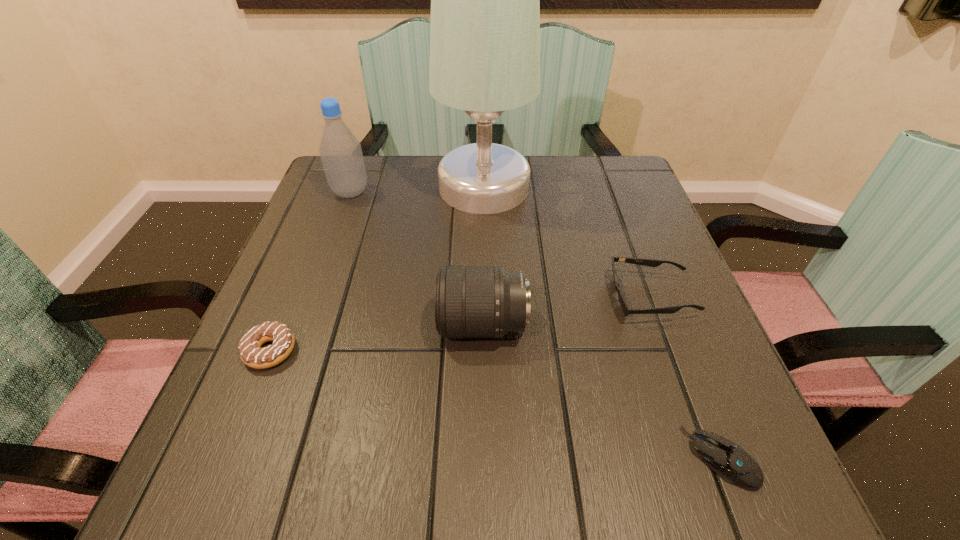
This screenshot has width=960, height=540. In order to click on vacant region that satisfies the following two spatial constraints: 1. on the back side of the shortest object; 2. on the front-facing side of the third shortest object in this screenshot , I will do `click(659, 297)`.